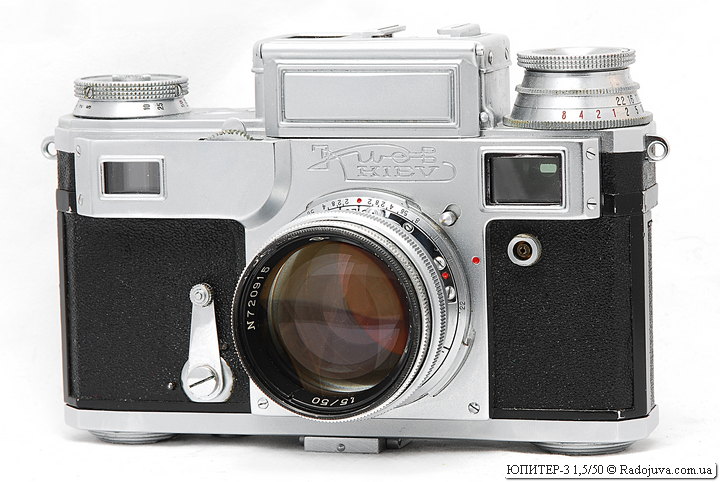
Where is `knob`? Image resolution: width=720 pixels, height=482 pixels. knob is located at coordinates point(140,90).